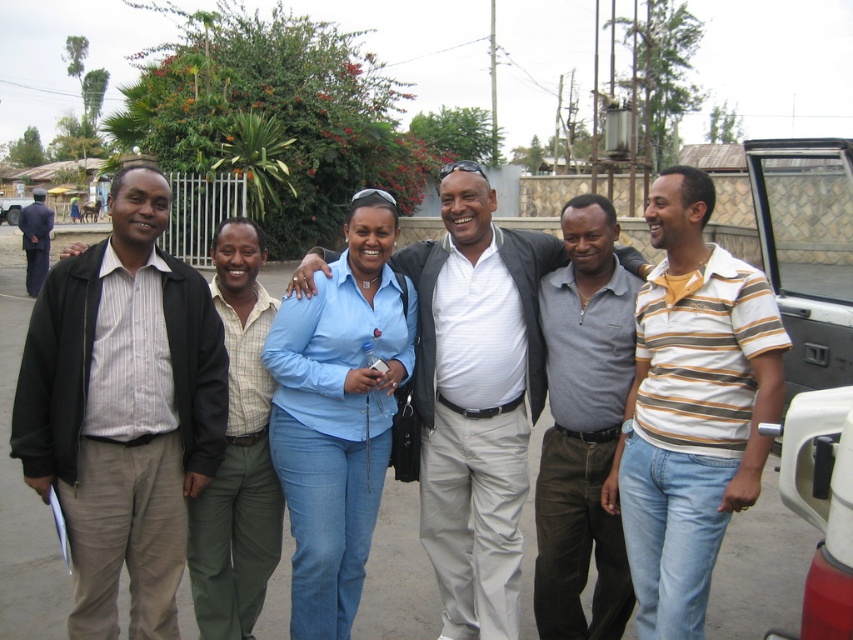
Question: Does matte blue shirt at center appear under dark blue uniform at left?

Choices:
 (A) no
 (B) yes

Answer: (B)

Question: Among these objects, which one is nearest to the camera?

Choices:
 (A) light blue shirt at center
 (B) matte blue shirt at center

Answer: (B)

Question: Does light blue shirt at center appear under green cotton pants at center?

Choices:
 (A) no
 (B) yes

Answer: (A)

Question: Is light blue shirt at center above green cotton pants at center?

Choices:
 (A) yes
 (B) no

Answer: (A)

Question: Which object is positioned farthest from the white plastic pickup truck at right?

Choices:
 (A) light blue shirt at center
 (B) gray cotton shirt at center
 (C) green cotton pants at center

Answer: (C)

Question: Among these objects, which one is farthest from the camera?

Choices:
 (A) dark blue uniform at left
 (B) matte blue shirt at center
 (C) white plastic car at right
 (D) striped fabric shirt at left

Answer: (A)